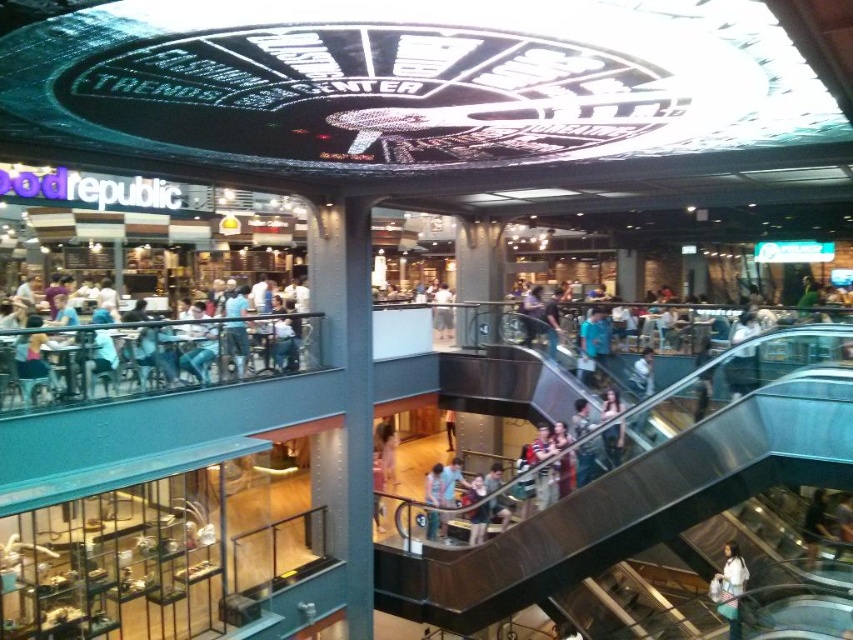
Question: Can you confirm if metallic escalator at center is positioned below white fabric bag at lower right?

Choices:
 (A) no
 (B) yes

Answer: (A)

Question: Which object is positioned closest to the white fabric bag at lower right?

Choices:
 (A) light blue denim jeans at center
 (B) blue denim jeans at upper left
 (C) metallic escalator at center
 (D) light brown leather jacket at center

Answer: (C)

Question: Is white fabric bag at lower right bigger than light brown leather jacket at center?

Choices:
 (A) yes
 (B) no

Answer: (A)

Question: Where is blue denim jeans at upper left located in relation to light brown leather jacket at center in the image?

Choices:
 (A) left
 (B) right

Answer: (A)

Question: Which of the following is the farthest from the observer?

Choices:
 (A) (486, 502)
 (B) (93, 336)
 (C) (572, 538)
 (D) (729, 548)

Answer: (A)

Question: Which object is farther from the camera taking this photo?

Choices:
 (A) light blue denim jeans at center
 (B) white fabric bag at lower right

Answer: (A)